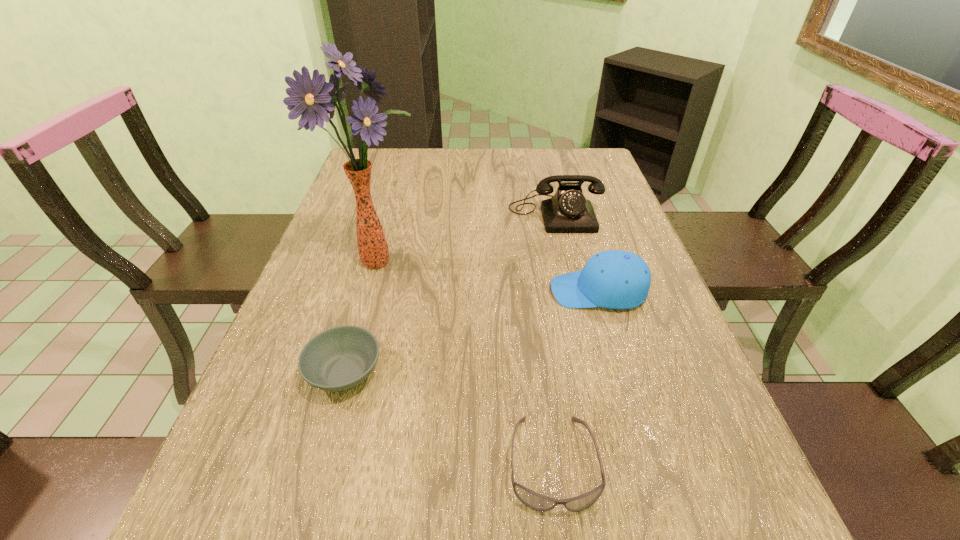
In order to click on free space between the second nearest object and the flower arrangement in this screenshot , I will do `click(362, 316)`.

Identify the location of free area in between the telephone and the fourth farthest object. This screenshot has width=960, height=540. (450, 293).

Image resolution: width=960 pixels, height=540 pixels. I want to click on vacant space in between the cap and the flower arrangement, so click(489, 276).

This screenshot has width=960, height=540. What are the coordinates of `free point between the sunglasses and the flower arrangement` in the screenshot? It's located at (466, 361).

You are a GUI agent. You are given a task and a screenshot of the screen. Output one action in this format:
    pyautogui.click(x=<x>, y=<y>)
    Task: Click on the free area in between the nearest object and the flower arrangement
    The width and height of the screenshot is (960, 540).
    Given the screenshot: What is the action you would take?
    pyautogui.click(x=466, y=361)

Locate an element on the screen. This screenshot has width=960, height=540. vacant space that is in between the farthest object and the nearest object is located at coordinates (554, 338).

Image resolution: width=960 pixels, height=540 pixels. Find the location of `free space between the telephone and the soup bowl`. free space between the telephone and the soup bowl is located at coordinates (450, 293).

Where is `unoccupied area between the tallest object and the cap`? unoccupied area between the tallest object and the cap is located at coordinates (489, 276).

At what (x,y) coordinates should I click in order to perform the action: click on vacant space that is in between the nearest object and the cap. Please return your answer as a coordinate pair (x, y). The width and height of the screenshot is (960, 540). Looking at the image, I should click on (575, 377).

You are a GUI agent. You are given a task and a screenshot of the screen. Output one action in this format:
    pyautogui.click(x=<x>, y=<y>)
    Task: Click on the empty space between the flower arrangement and the cap
    This screenshot has height=540, width=960.
    Given the screenshot: What is the action you would take?
    click(489, 276)